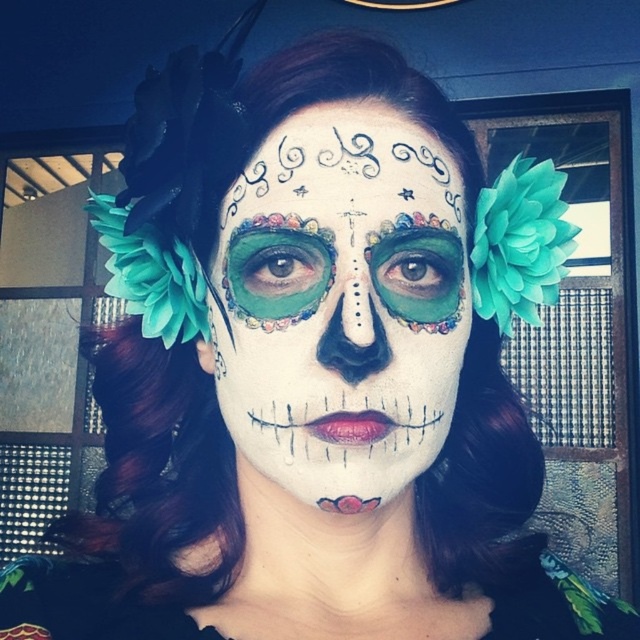
Based on the scene description, which object occupies a larger portion of the image? The white matte face paint at center or the matte black dress at center?

The white matte face paint at center is much taller than the matte black dress at center, so the white matte face paint at center occupies a larger portion of the image.

You are a photographer trying to capture the intricate details of the white matte face paint at center and the matte black dress at center. Since both are at the center, which one will appear closer to the camera in the photo?

The white matte face paint at center will appear closer to the camera than the matte black dress at center because it is positioned in front of it.

You are a photographer at a Day of the Dead festival. You need to capture a photo where the white matte face paint at center is visible above the matte black dress at center. Based on the scene description, will this be possible?

Yes, the white matte face paint at center is above the matte black dress at center, so it will be visible in the photo.